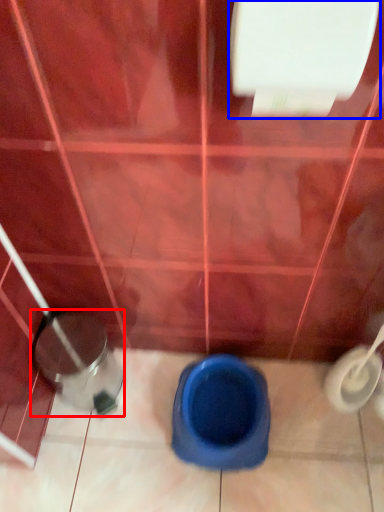
Question: Which of the following is the farthest to the observer, potty (highlighted by a red box) or toilet paper (highlighted by a blue box)?

Choices:
 (A) potty
 (B) toilet paper

Answer: (A)